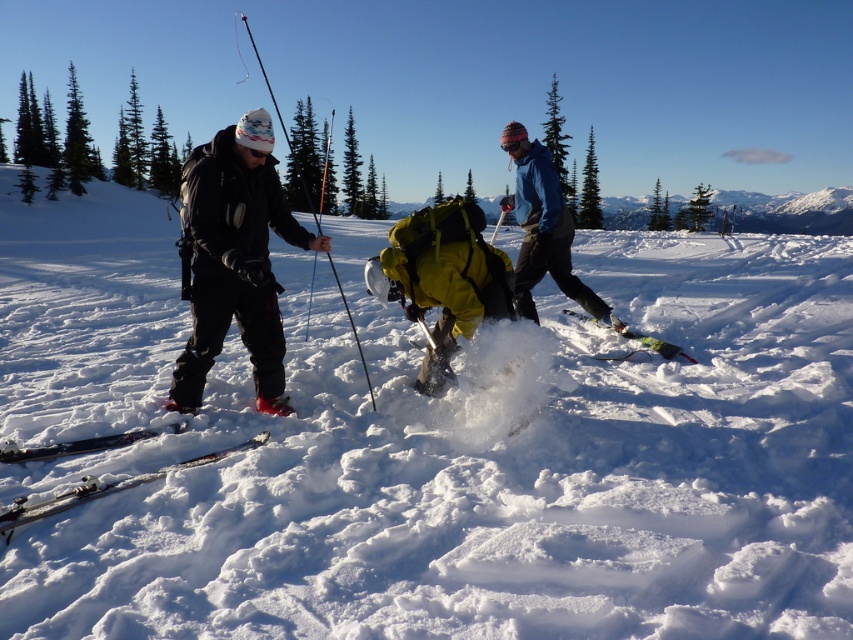
Question: Based on their relative distances, which object is farther from the matte black jacket at left?

Choices:
 (A) blue fleece jacket at center
 (B) green matte ski at lower center
 (C) shiny black skis at lower left
 (D) white fluffy snow at center

Answer: (A)

Question: Which of the following is the closest to the observer?

Choices:
 (A) blue fleece jacket at center
 (B) yellow matte snowboard at center

Answer: (B)

Question: Is matte black jacket at left further to the viewer compared to shiny black skis at lower left?

Choices:
 (A) no
 (B) yes

Answer: (B)

Question: Which object is positioned farthest from the white fluffy snow at center?

Choices:
 (A) green matte ski at lower center
 (B) matte black jacket at center

Answer: (A)

Question: From the image, what is the correct spatial relationship of blue fleece jacket at center in relation to shiny black skis at lower left?

Choices:
 (A) above
 (B) below

Answer: (A)

Question: Is white fluffy snow at center further to camera compared to matte black jacket at left?

Choices:
 (A) yes
 (B) no

Answer: (B)